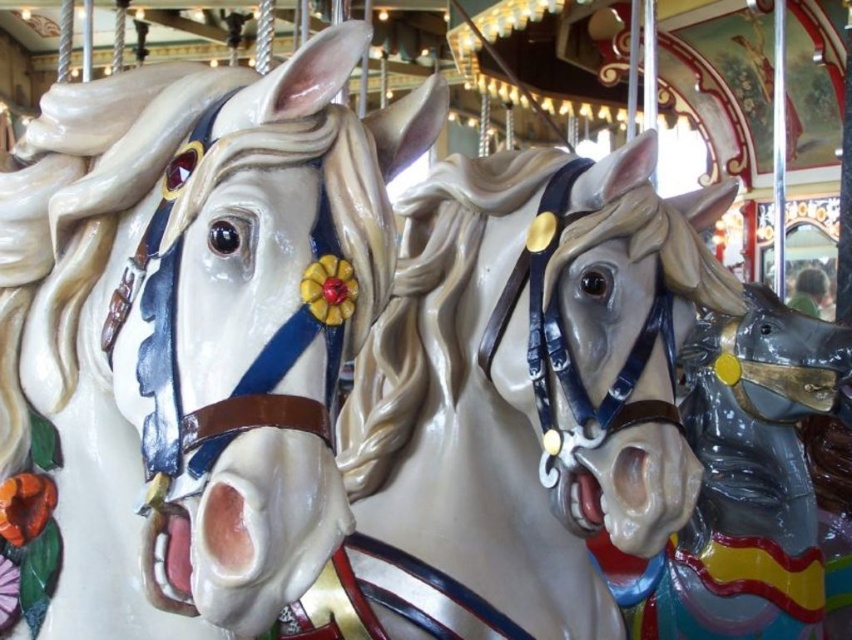
Measure the distance between shiny gold bridle at center and glossy plastic horse at center.

shiny gold bridle at center is 12.88 feet away from glossy plastic horse at center.

Between shiny gold bridle at center and glossy plastic horse at center, which one is positioned lower?

Positioned lower is glossy plastic horse at center.

Locate an element on the screen. shiny gold bridle at center is located at coordinates (519, 400).

How far apart are matte white horse at center and glossy plastic horse at center?

matte white horse at center is 22.37 feet away from glossy plastic horse at center.

Can you confirm if matte white horse at center is taller than glossy plastic horse at center?

In fact, matte white horse at center may be shorter than glossy plastic horse at center.

Who is more distant from viewer, (289,445) or (784,404)?

Positioned behind is point (784,404).

In order to click on matte white horse at center in this screenshot , I will do 187,337.

Which is behind, point (352, 22) or point (605, 321)?

Positioned behind is point (605, 321).

Image resolution: width=852 pixels, height=640 pixels. In order to click on matte white horse at center in this screenshot , I will do `click(187, 337)`.